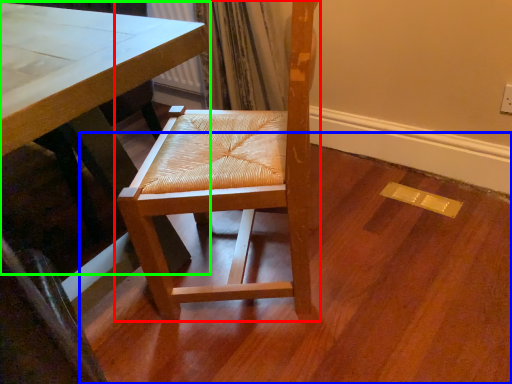
Question: Estimate the real-world distances between objects in this image. Which object is farther from chair (highlighted by a red box), plywood (highlighted by a blue box) or table (highlighted by a green box)?

Choices:
 (A) plywood
 (B) table

Answer: (A)